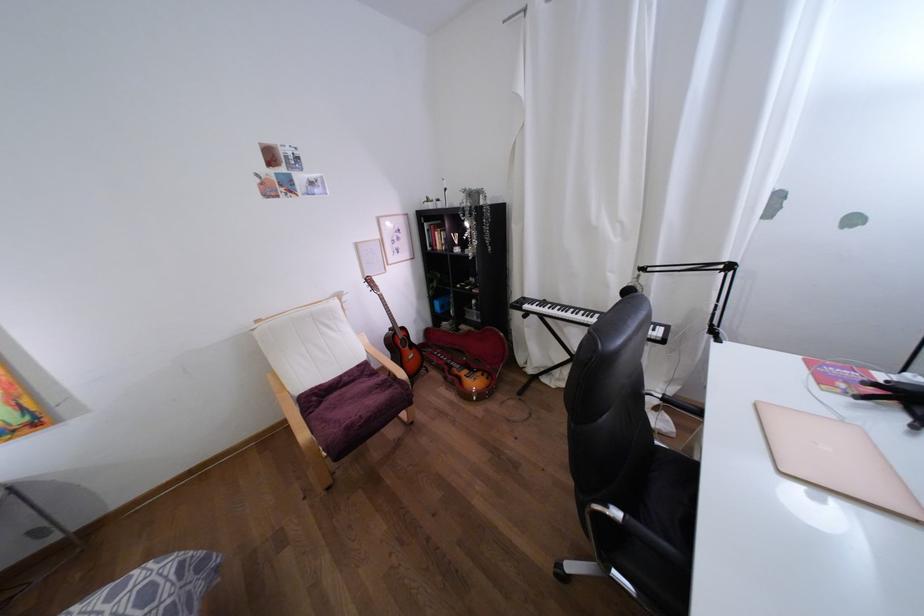
Find where to press the keyboard keys. Please return your answer as a coordinate pair (x, y).

(579, 315)